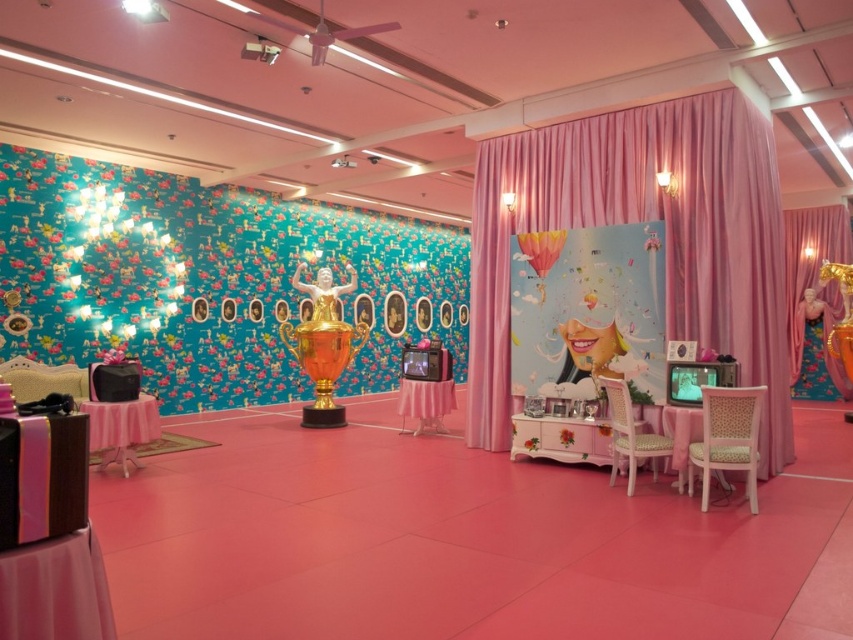
Question: Among these points, which one is farthest from the camera?

Choices:
 (A) (672, 144)
 (B) (618, 410)

Answer: (A)

Question: Can you confirm if velvet pink curtain at center is positioned above wooden chair at lower right?

Choices:
 (A) yes
 (B) no

Answer: (A)

Question: Which object is closer to the camera taking this photo?

Choices:
 (A) pink velvet curtain at right
 (B) velvet pink curtain at center
 (C) matte pink chair at lower right
 (D) matte pink balloon at center

Answer: (C)

Question: Is pink velvet curtain at right to the right of matte pink chair at lower right from the viewer's perspective?

Choices:
 (A) no
 (B) yes

Answer: (B)

Question: Estimate the real-world distances between objects in this image. Which object is closer to the wooden chair at lower right?

Choices:
 (A) matte pink balloon at center
 (B) velvet pink curtain at center

Answer: (B)

Question: Is velvet pink curtain at center bigger than wooden chair at lower right?

Choices:
 (A) yes
 (B) no

Answer: (A)